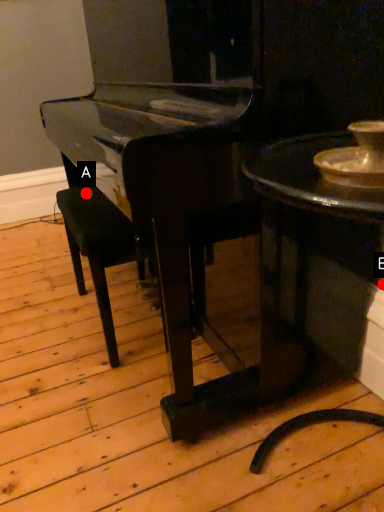
Question: Two points are circled on the image, labeled by A and B beside each circle. Which point appears farthest from the camera in this image?

Choices:
 (A) A is further
 (B) B is further

Answer: (A)